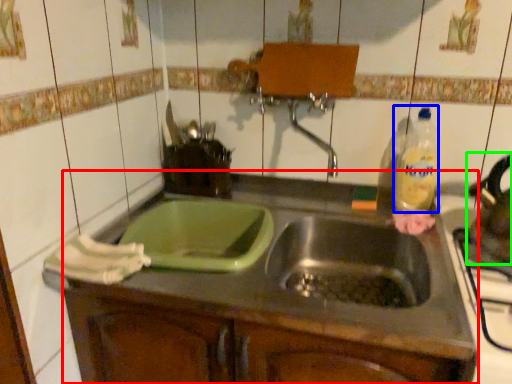
Question: Which object is the closest to the countertop (highlighted by a red box)? Choose among these: bottle (highlighted by a blue box) or tea pot (highlighted by a green box).

Choices:
 (A) bottle
 (B) tea pot

Answer: (A)